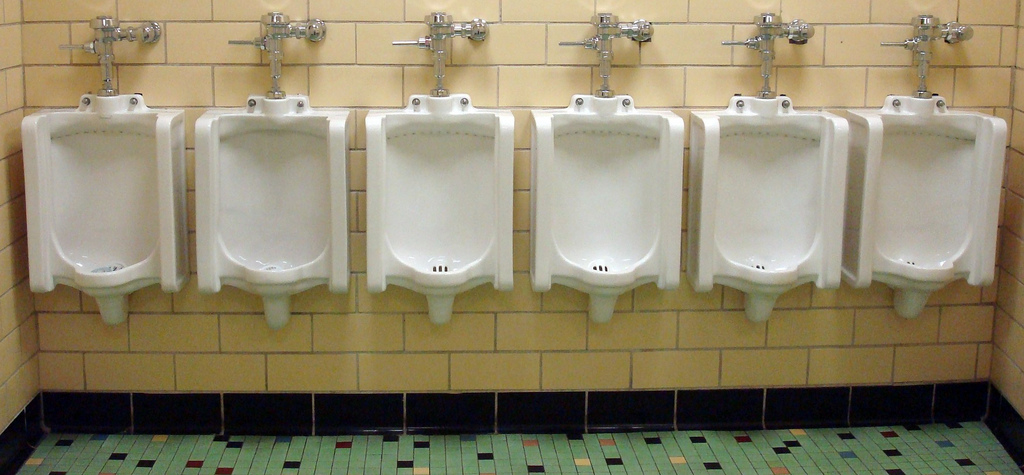
Locate an element on the screen. urinals is located at coordinates (118, 212), (272, 212), (444, 217), (592, 213), (755, 217), (935, 226).